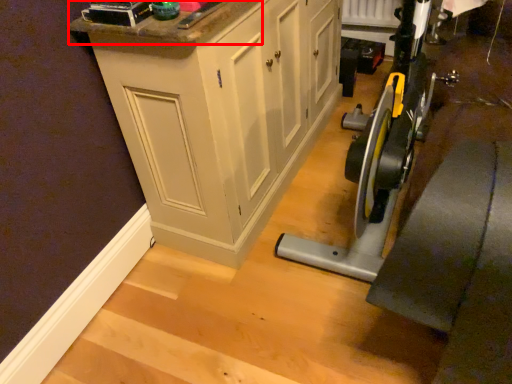
Question: In this image, where is counter top (annotated by the red box) located relative to cabinetry?

Choices:
 (A) left
 (B) right

Answer: (A)